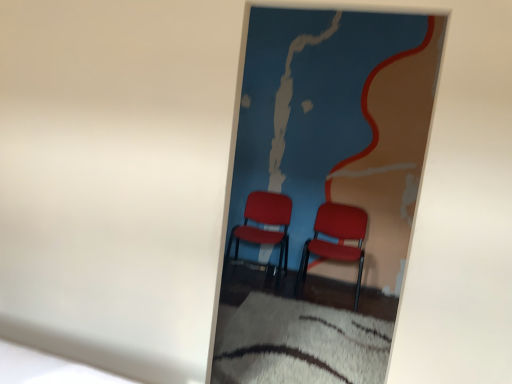
Question: Does matte plastic chair at center, which ranks as the second chair in right-to-left order, have a greater width compared to matte red chair at center, arranged as the 2th chair when viewed from the left?

Choices:
 (A) no
 (B) yes

Answer: (B)

Question: From the image's perspective, is matte plastic chair at center, the 1th chair from the left, below matte red chair at center, arranged as the 2th chair when viewed from the left?

Choices:
 (A) no
 (B) yes

Answer: (A)

Question: Is matte plastic chair at center, the 1th chair from the left, next to matte red chair at center, arranged as the 2th chair when viewed from the left, and touching it?

Choices:
 (A) yes
 (B) no

Answer: (B)

Question: Is matte plastic chair at center, the 1th chair from the left, shorter than matte red chair at center, marked as the 1th chair in a right-to-left arrangement?

Choices:
 (A) yes
 (B) no

Answer: (B)

Question: Can you confirm if matte plastic chair at center, which ranks as the second chair in right-to-left order, is thinner than matte red chair at center, marked as the 1th chair in a right-to-left arrangement?

Choices:
 (A) yes
 (B) no

Answer: (B)

Question: Could you tell me if matte plastic chair at center, the 1th chair from the left, is turned towards matte red chair at center, marked as the 1th chair in a right-to-left arrangement?

Choices:
 (A) yes
 (B) no

Answer: (B)

Question: From a real-world perspective, is white shaggy rug at lower center located beneath matte red chair at center, arranged as the 2th chair when viewed from the left?

Choices:
 (A) no
 (B) yes

Answer: (B)

Question: Does white shaggy rug at lower center appear on the left side of matte red chair at center, arranged as the 2th chair when viewed from the left?

Choices:
 (A) yes
 (B) no

Answer: (A)

Question: Is white shaggy rug at lower center not within matte red chair at center, marked as the 1th chair in a right-to-left arrangement?

Choices:
 (A) no
 (B) yes

Answer: (B)

Question: Is matte red chair at center, marked as the 1th chair in a right-to-left arrangement, located within white shaggy rug at lower center?

Choices:
 (A) yes
 (B) no

Answer: (B)

Question: From the image's perspective, would you say white shaggy rug at lower center is positioned over matte red chair at center, arranged as the 2th chair when viewed from the left?

Choices:
 (A) yes
 (B) no

Answer: (B)

Question: Is white shaggy rug at lower center oriented away from matte red chair at center, marked as the 1th chair in a right-to-left arrangement?

Choices:
 (A) no
 (B) yes

Answer: (A)

Question: Is matte red chair at center, marked as the 1th chair in a right-to-left arrangement, closer to the viewer compared to matte plastic chairs at center?

Choices:
 (A) no
 (B) yes

Answer: (A)